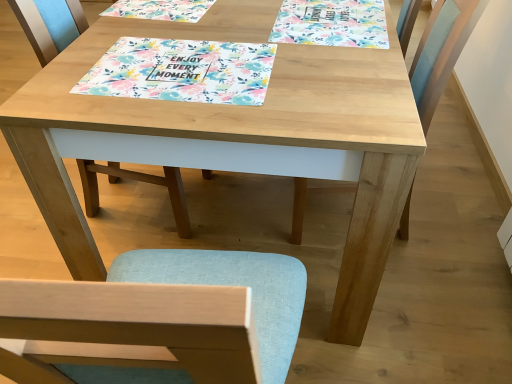
Where is `free space on the front side of floral paper placemat at upper center`? free space on the front side of floral paper placemat at upper center is located at coordinates (327, 78).